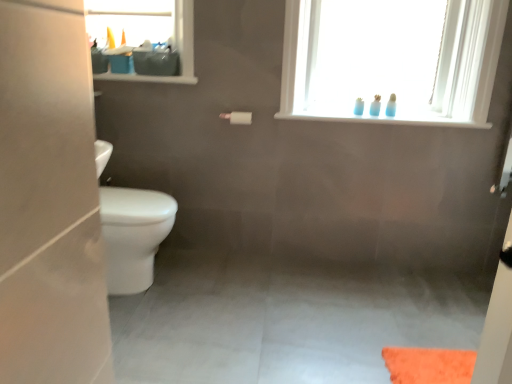
Question: Considering the relative sizes of translucent plastic bottles at upper center, which is the 3th toiletry in right-to-left order, and transparent glass bottles at upper center in the image provided, is translucent plastic bottles at upper center, which is the 3th toiletry in right-to-left order, wider than transparent glass bottles at upper center?

Choices:
 (A) no
 (B) yes

Answer: (A)

Question: From a real-world perspective, does translucent plastic bottles at upper center, which is the 3th toiletry in right-to-left order, stand above transparent glass bottles at upper center?

Choices:
 (A) no
 (B) yes

Answer: (A)

Question: Are translucent plastic bottles at upper center, which is the 3th toiletry in right-to-left order, and transparent glass bottles at upper center located far from each other?

Choices:
 (A) no
 (B) yes

Answer: (A)

Question: Can you confirm if translucent plastic bottles at upper center, arranged as the first toiletry when viewed from the left, is smaller than transparent glass bottles at upper center?

Choices:
 (A) yes
 (B) no

Answer: (A)

Question: Is translucent plastic bottles at upper center, arranged as the first toiletry when viewed from the left, aimed at transparent glass bottles at upper center?

Choices:
 (A) yes
 (B) no

Answer: (A)

Question: In terms of height, does blue translucent toothbrushes at upper right, which is the 3th toiletry in left-to-right order, look taller or shorter compared to white matte toilet paper at center?

Choices:
 (A) short
 (B) tall

Answer: (B)

Question: From the image's perspective, relative to white matte toilet paper at center, is blue translucent toothbrushes at upper right, which is the 3th toiletry in left-to-right order, above or below?

Choices:
 (A) below
 (B) above

Answer: (B)

Question: Visually, is blue translucent toothbrushes at upper right, arranged as the 1th toiletry when viewed from the right, positioned to the left or to the right of white matte toilet paper at center?

Choices:
 (A) left
 (B) right

Answer: (B)

Question: Does point (389, 102) appear closer or farther from the camera than point (229, 115)?

Choices:
 (A) closer
 (B) farther

Answer: (A)

Question: From a real-world perspective, is blue translucent toothbrushes at upper right, which is the 3th toiletry in left-to-right order, above or below blue plastic toothbrushes at upper right, the 2th toiletry in the left-to-right sequence?

Choices:
 (A) below
 (B) above

Answer: (B)

Question: Considering the relative positions of blue translucent toothbrushes at upper right, which is the 3th toiletry in left-to-right order, and blue plastic toothbrushes at upper right, the second toiletry from the right, in the image provided, is blue translucent toothbrushes at upper right, which is the 3th toiletry in left-to-right order, to the left or to the right of blue plastic toothbrushes at upper right, the second toiletry from the right,?

Choices:
 (A) right
 (B) left

Answer: (A)

Question: In the image, is blue translucent toothbrushes at upper right, arranged as the 1th toiletry when viewed from the right, positioned in front of or behind blue plastic toothbrushes at upper right, the 2th toiletry in the left-to-right sequence?

Choices:
 (A) front
 (B) behind

Answer: (A)

Question: Based on their sizes in the image, would you say blue translucent toothbrushes at upper right, which is the 3th toiletry in left-to-right order, is bigger or smaller than blue plastic toothbrushes at upper right, the 2th toiletry in the left-to-right sequence?

Choices:
 (A) small
 (B) big

Answer: (B)

Question: Is white matte toilet paper at center to the left or to the right of translucent plastic bottles at upper center, arranged as the first toiletry when viewed from the left, in the image?

Choices:
 (A) right
 (B) left

Answer: (B)

Question: Is white matte toilet paper at center taller or shorter than translucent plastic bottles at upper center, arranged as the first toiletry when viewed from the left?

Choices:
 (A) tall
 (B) short

Answer: (B)